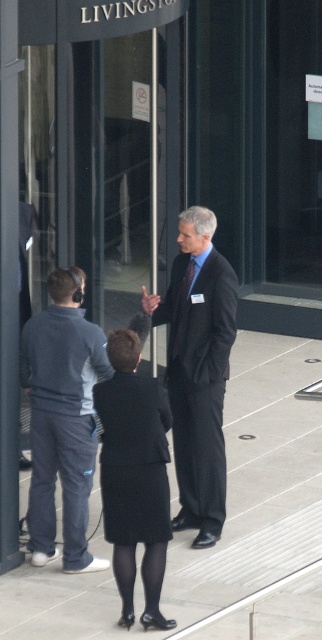
What do you see at coordinates (198, 369) in the screenshot? I see `dark suit at center` at bounding box center [198, 369].

Between point (212, 419) and point (135, 358), which one is positioned behind?

The point (212, 419) is behind.

What do you see at coordinates (198, 369) in the screenshot?
I see `dark suit at center` at bounding box center [198, 369].

The image size is (322, 640). Find the location of `dark suit at center`. dark suit at center is located at coordinates (198, 369).

Which is in front, point (102, 336) or point (112, 474)?

Positioned in front is point (112, 474).

Between point (56, 378) and point (126, 515), which one is positioned behind?

The point (56, 378) is more distant.

In order to click on dark gray fleece jacket at left in this screenshot , I will do `click(63, 419)`.

Between dark suit at center and dark gray fleece jacket at left, which one has less height?

dark gray fleece jacket at left

Measure the distance between dark suit at center and camera.

dark suit at center is 8.28 meters away from camera.

Locate an element on the screen. This screenshot has height=640, width=322. dark suit at center is located at coordinates (198, 369).